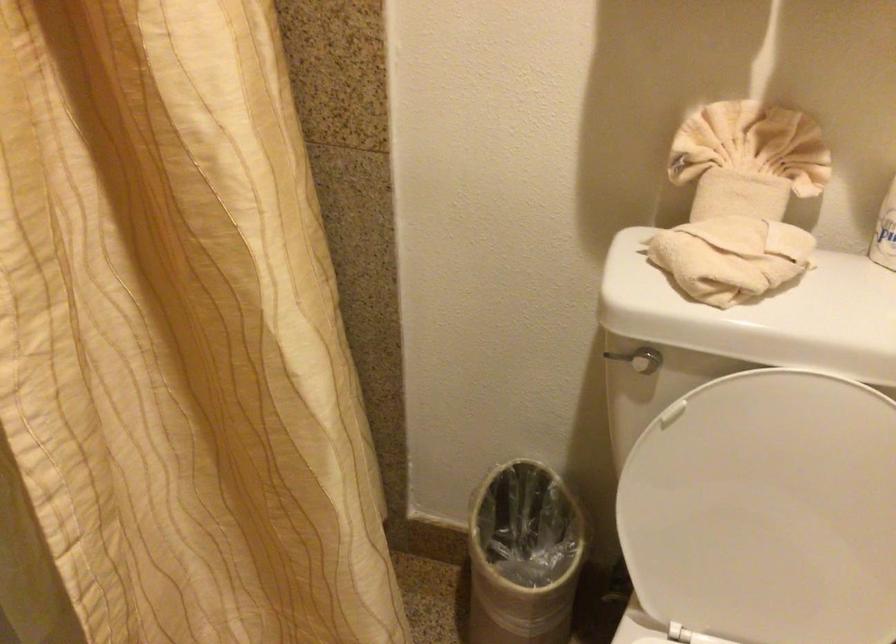
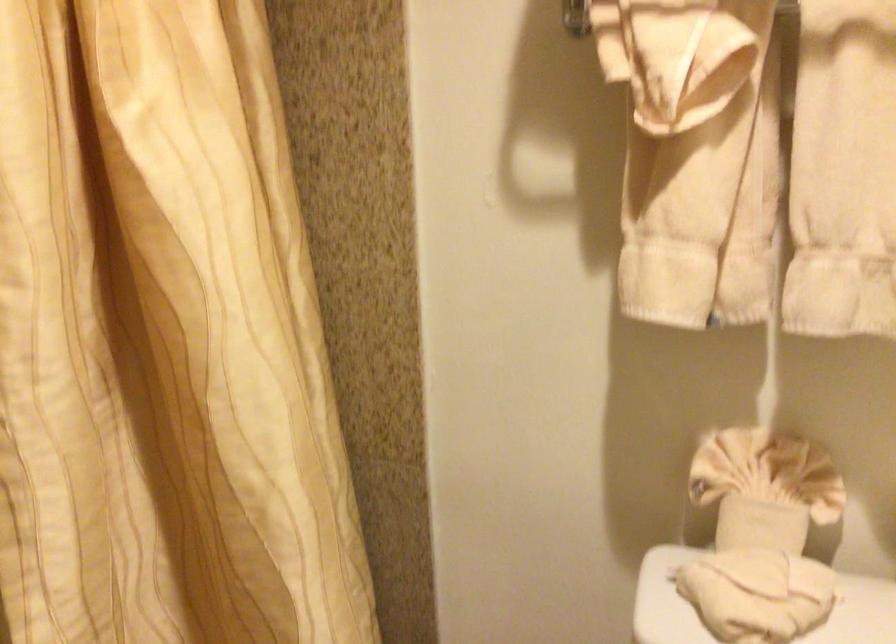
Question: What movement of the cameraman would produce the second image?

Choices:
 (A) Left
 (B) Right
 (C) Forward
 (D) Backward

Answer: (D)